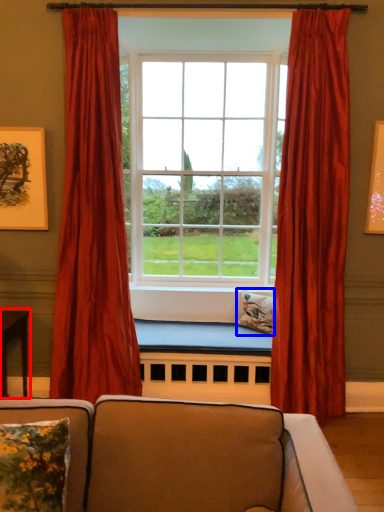
Question: Which point is further to the camera, table (highlighted by a red box) or pillow (highlighted by a blue box)?

Choices:
 (A) table
 (B) pillow

Answer: (B)